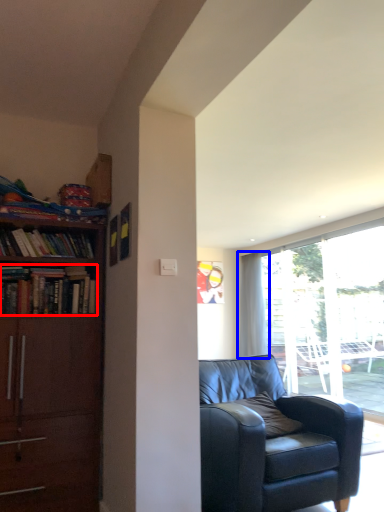
Question: Among these objects, which one is farthest to the camera, book (highlighted by a red box) or curtain (highlighted by a blue box)?

Choices:
 (A) book
 (B) curtain

Answer: (B)